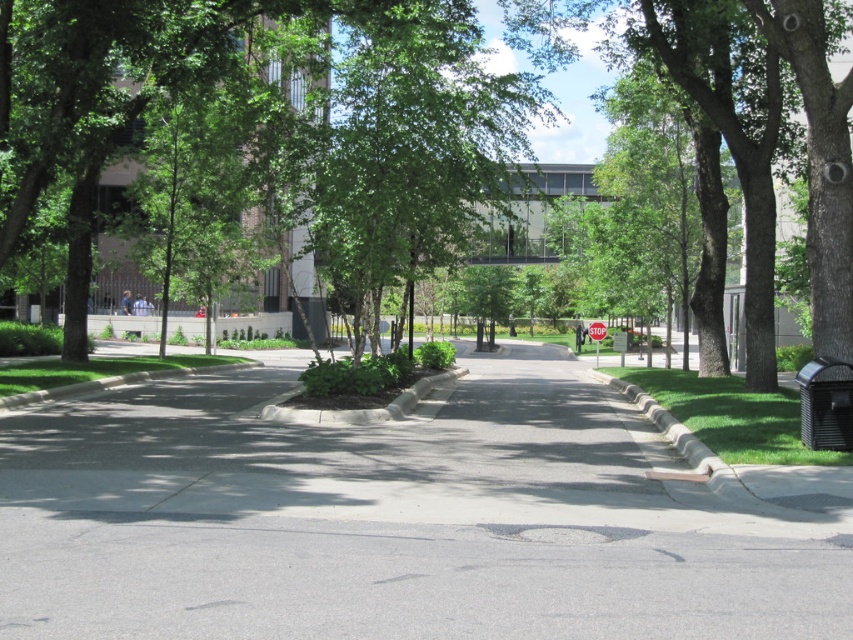
You are a pedestrian walking along the gray asphalt pavement at center and the green leafy tree at center. Which object is closer to you as you walk?

The gray asphalt pavement at center is closer to you because it is in front of the green leafy tree at center.

You are a delivery drone flying over an urban park. You need to land on the gray asphalt pavement at center. What are the coordinates where you should aim to land?

The gray asphalt pavement at center is located at coordinates point (392, 518). You should aim for that point to land.